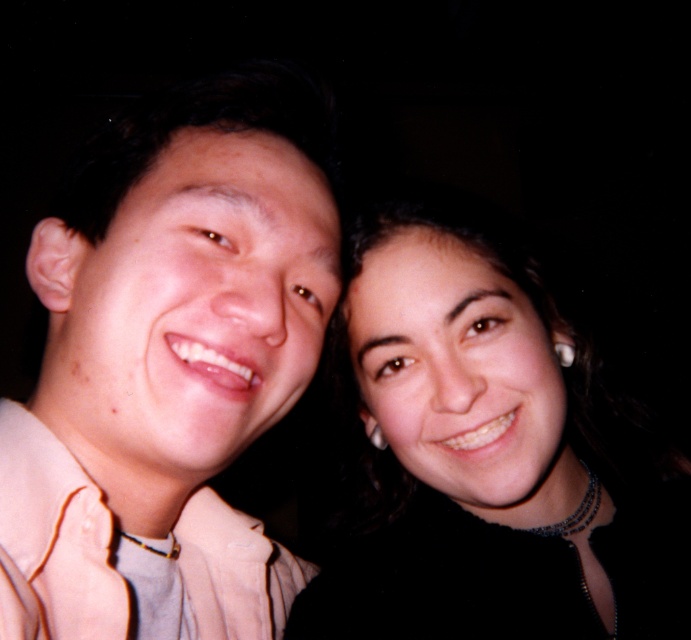
Question: Is light beige shirt at left to the right of smooth black hair at center from the viewer's perspective?

Choices:
 (A) no
 (B) yes

Answer: (A)

Question: Observing the image, what is the correct spatial positioning of light beige shirt at left in reference to smooth black hair at center?

Choices:
 (A) above
 (B) below

Answer: (A)

Question: Observing the image, what is the correct spatial positioning of light beige shirt at left in reference to smooth black hair at center?

Choices:
 (A) below
 (B) above

Answer: (B)

Question: Which object appears farthest from the camera in this image?

Choices:
 (A) smooth black hair at center
 (B) light beige shirt at left

Answer: (A)

Question: Which point is farther to the camera?

Choices:
 (A) (171, 595)
 (B) (529, 634)

Answer: (B)